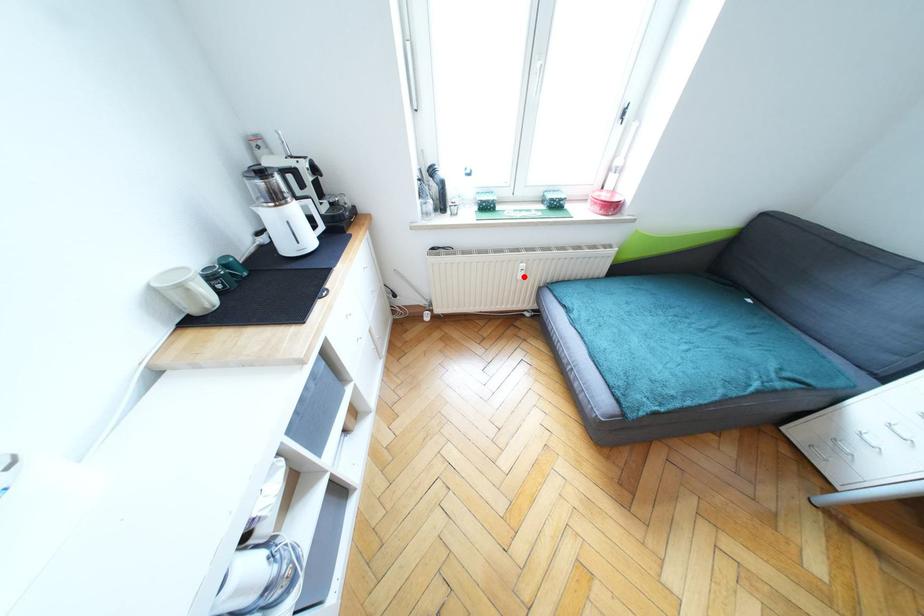
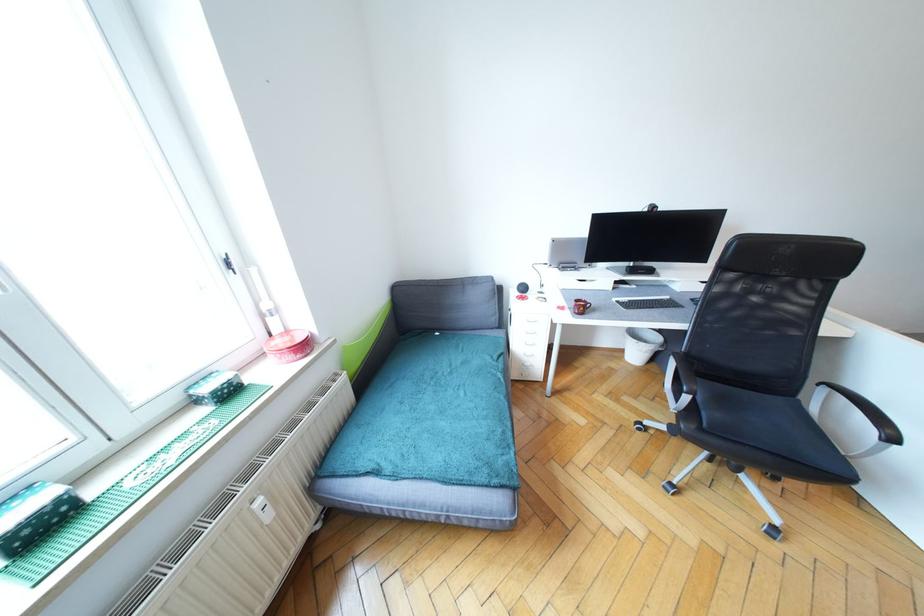
The point at the highlighted location is marked in the first image. Where is the corresponding point in the second image?

(272, 517)